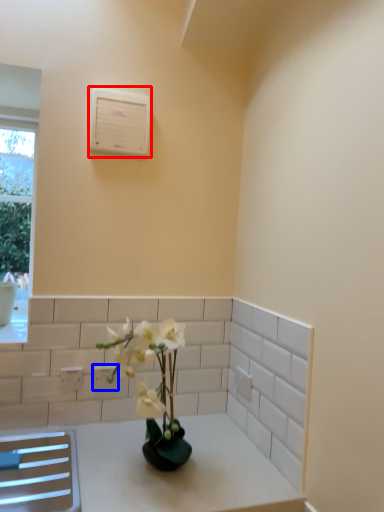
Question: Which of the following is the closest to the observer, air conditioning (highlighted by a red box) or electric outlet (highlighted by a blue box)?

Choices:
 (A) air conditioning
 (B) electric outlet

Answer: (A)